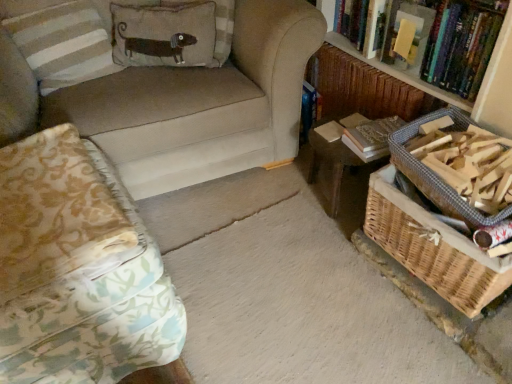
Question: Considering the positions of striped fabric pillow at upper left, placed as the 3th pillow when sorted from right to left, and patterned fabric studio couch at left, which appears as the second studio couch when viewed from the top, in the image, is striped fabric pillow at upper left, placed as the 3th pillow when sorted from right to left, taller or shorter than patterned fabric studio couch at left, which appears as the second studio couch when viewed from the top,?

Choices:
 (A) short
 (B) tall

Answer: (A)

Question: Choose the correct answer: Is striped fabric pillow at upper left, which appears as the first pillow when viewed from the left, inside patterned fabric studio couch at left, which appears as the second studio couch when viewed from the top, or outside it?

Choices:
 (A) outside
 (B) inside

Answer: (A)

Question: Based on their relative distances, which object is nearer to the patterned fabric studio couch at left, placed as the 1th studio couch when sorted from bottom to top?

Choices:
 (A) suede-like beige couch at upper left, positioned as the 2th studio couch in bottom-to-top order
 (B) hardcover book at center right
 (C) striped fabric pillow at upper left, which appears as the first pillow when viewed from the left
 (D) brown fabric pillow with dog design at upper left, the third pillow from the left
 (E) woven brown basket at lower right, the first basket positioned from the bottom

Answer: (A)

Question: Which of these objects is positioned farthest from the woven brown basket at lower right, the second basket when ordered from top to bottom?

Choices:
 (A) woven wood table at center
 (B) textured beige pillow with dog design at upper left, arranged as the second pillow when viewed from the left
 (C) striped fabric pillow at upper left, placed as the 3th pillow when sorted from right to left
 (D) hardcover book at upper right
 (E) woven wood basket at lower right, which appears as the 2th basket when ordered from the bottom

Answer: (C)